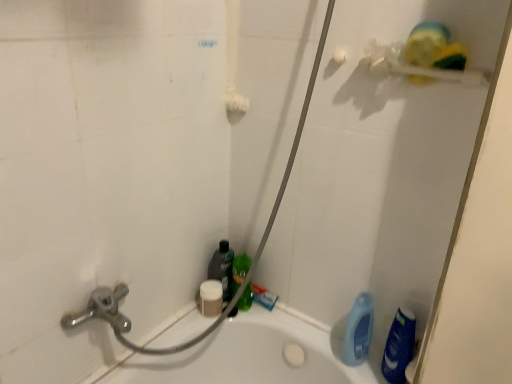
Question: In terms of height, does translucent plastic bottle at lower center, which ranks as the 4th cleaning product in right-to-left order, look taller or shorter compared to blue plastic bottle at lower right, which ranks as the fourth cleaning product in left-to-right order?

Choices:
 (A) short
 (B) tall

Answer: (A)

Question: Considering the positions of point (222, 248) and point (351, 317), is point (222, 248) closer or farther from the camera than point (351, 317)?

Choices:
 (A) closer
 (B) farther

Answer: (B)

Question: Which is farther from the white matte soap at center?

Choices:
 (A) yellow sponge at upper right
 (B) blue plastic bottle at lower right, acting as the 2th cleaning product starting from the right
 (C) green matte bottle at center, which appears as the third cleaning product when viewed from the left
 (D) blue glossy bottle at lower right, placed as the 5th cleaning product when sorted from left to right
 (E) translucent plastic bottle at lower center, which ranks as the second cleaning product in left-to-right order

Answer: (A)

Question: Which of these objects is positioned farthest from the green matte bottle at center, the third cleaning product in the right-to-left sequence?

Choices:
 (A) yellow sponge at upper right
 (B) white matte soap at center
 (C) blue plastic bottle at lower right, which ranks as the fourth cleaning product in left-to-right order
 (D) translucent plastic bottle at lower center, which ranks as the 4th cleaning product in right-to-left order
 (E) white matte sponge at lower center, arranged as the 1th cleaning product when viewed from the left

Answer: (A)